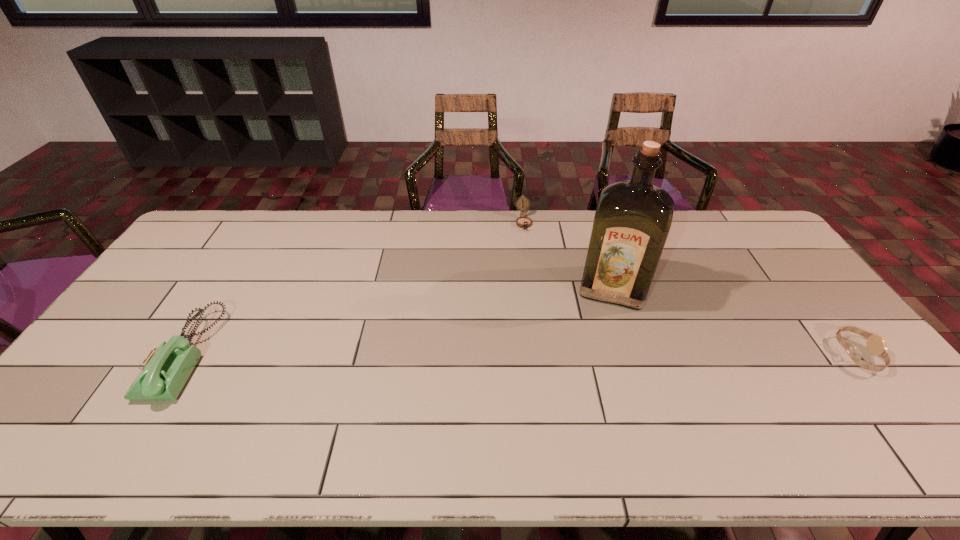
This screenshot has width=960, height=540. Identify the location of the third shortest object. (164, 372).

This screenshot has height=540, width=960. Identify the location of telephone. (164, 372).

I want to click on watch, so click(x=876, y=345).

Where is `the rightmost object`? the rightmost object is located at coordinates (876, 345).

Where is `liquor`? The width and height of the screenshot is (960, 540). liquor is located at coordinates (633, 218).

Locate an element on the screen. the tallest object is located at coordinates (633, 218).

At what (x,y) coordinates should I click in order to perform the action: click on the second object from left to right. Please return your answer as a coordinate pair (x, y). The width and height of the screenshot is (960, 540). Looking at the image, I should click on tap(524, 222).

Identify the location of compass. (524, 222).

Where is `vacant area located on the dial of the second tallest object`? This screenshot has width=960, height=540. vacant area located on the dial of the second tallest object is located at coordinates (116, 354).

Where is `free space located on the dial of the second tallest object`? free space located on the dial of the second tallest object is located at coordinates (120, 354).